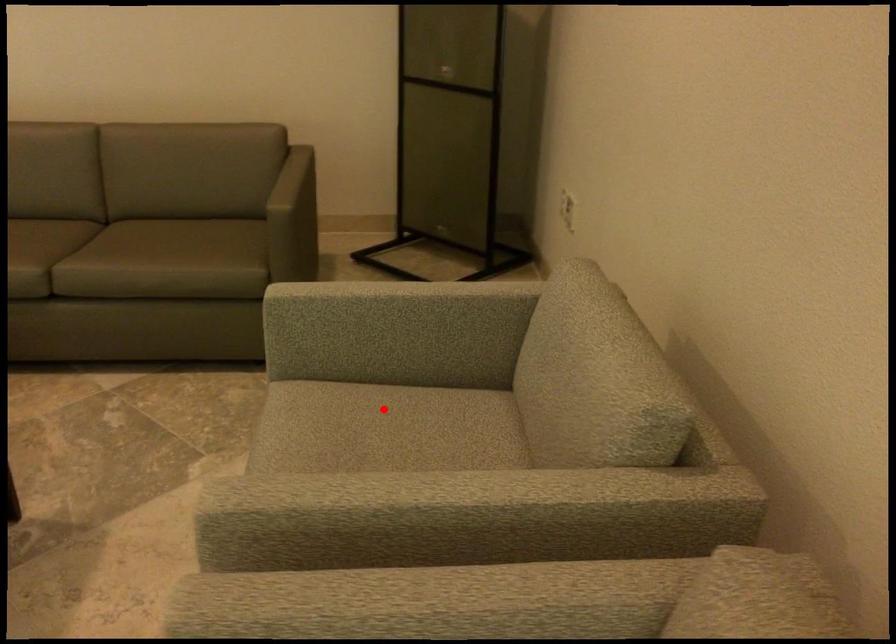
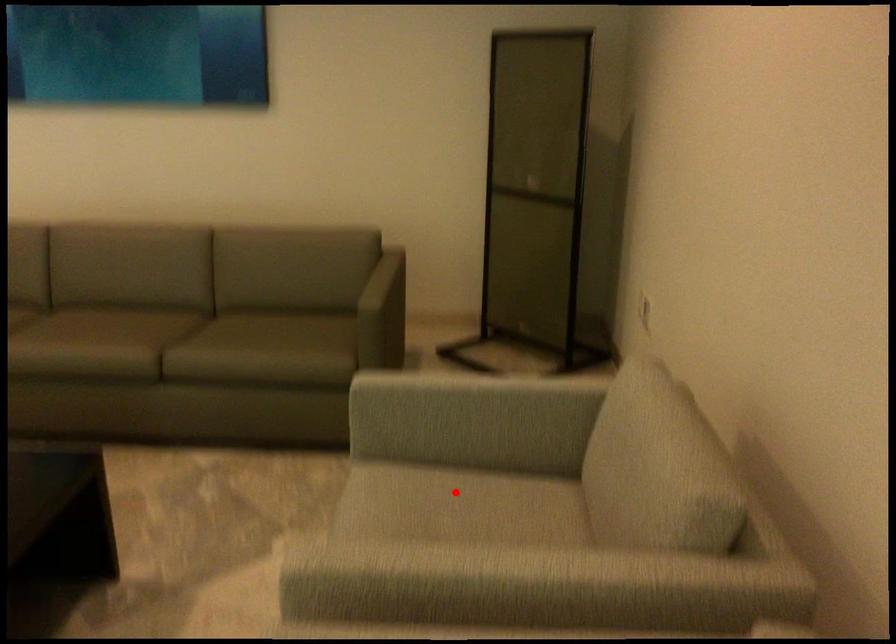
I am providing you with two images of the same scene from different viewpoints. A red point is marked on the first image and another point is marked on the second image. Are the points marked in image1 and image2 representing the same 3D position?

Yes